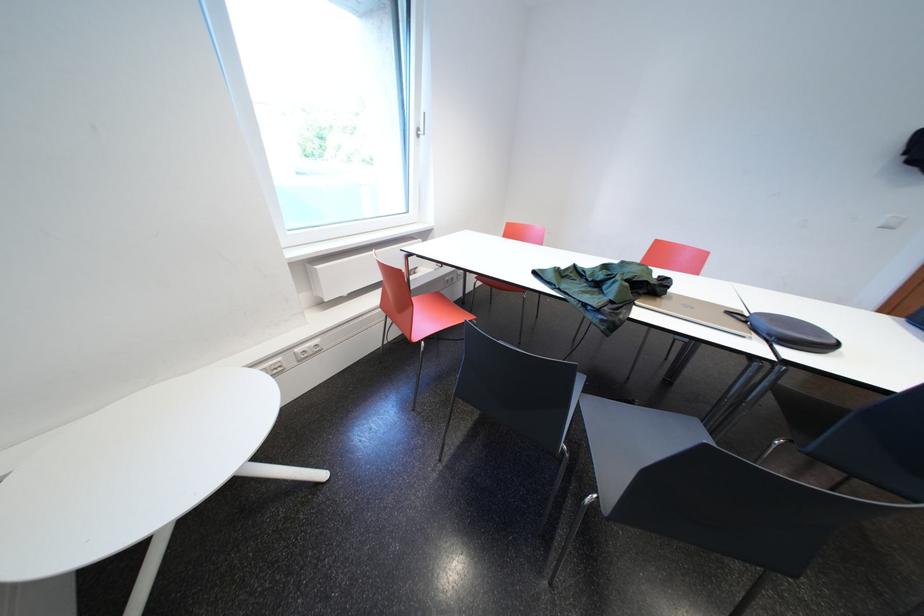
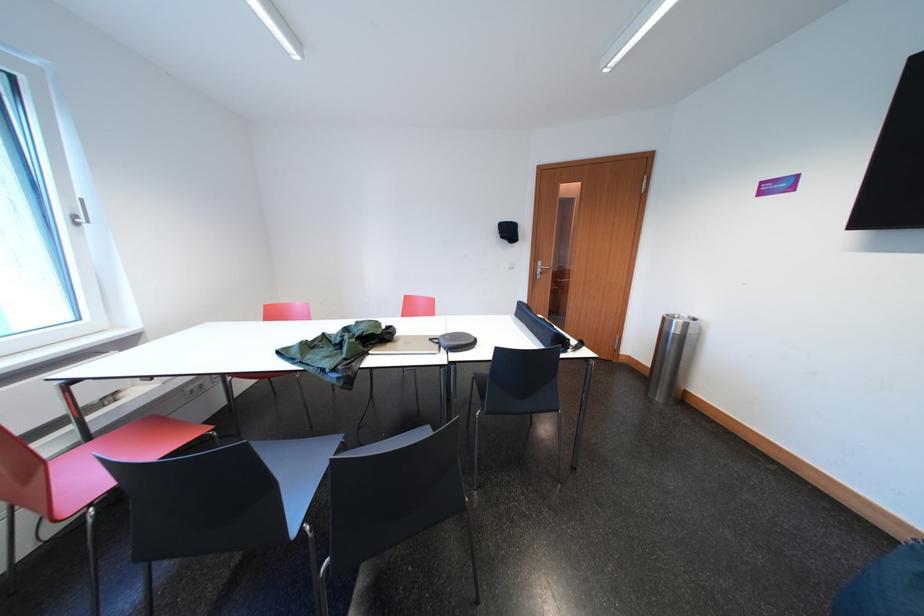
Find the pixel in the second image that matches point (633, 267) in the first image.

(367, 326)